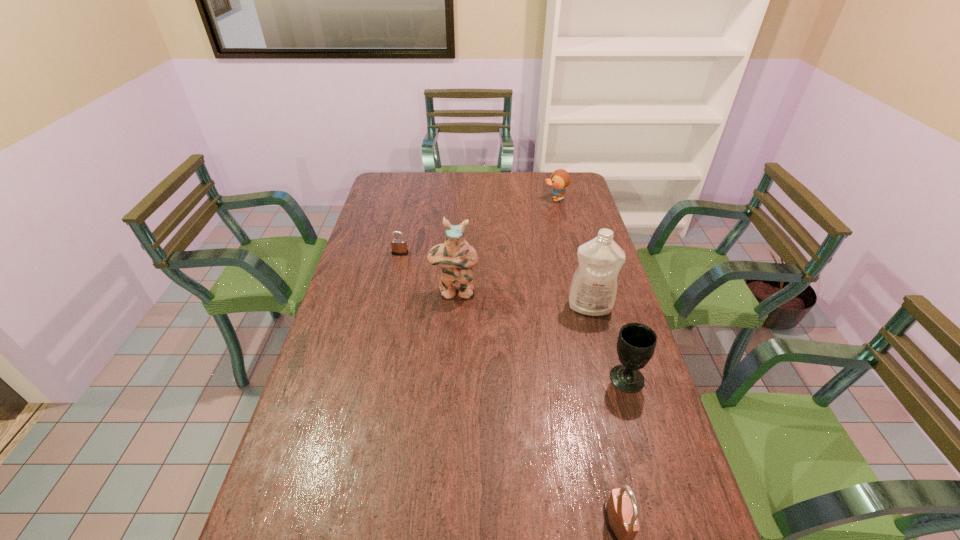
Identify the location of vacant region that satisfies the following two spatial constraints: 1. on the front-facing side of the detergent; 2. on the left side of the duck. This screenshot has height=540, width=960. (582, 307).

At what (x,y) coordinates should I click in order to perform the action: click on vacant space that satisfies the following two spatial constraints: 1. on the front-facing side of the duck; 2. on the front-facing side of the fifth object from right to left. Please return your answer as a coordinate pair (x, y). The height and width of the screenshot is (540, 960). Looking at the image, I should click on (578, 293).

Where is `vacant space that satisfies the following two spatial constraints: 1. on the front-facing side of the farthest object; 2. on the right side of the detergent`? vacant space that satisfies the following two spatial constraints: 1. on the front-facing side of the farthest object; 2. on the right side of the detergent is located at coordinates (582, 307).